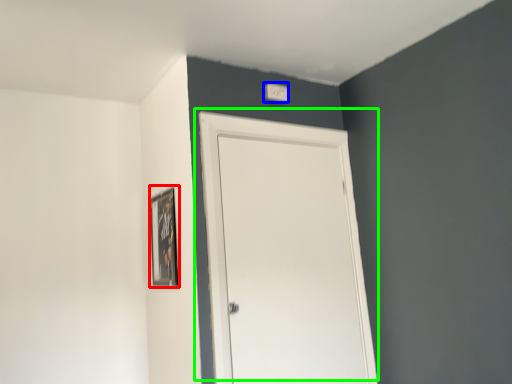
Question: Based on their relative distances, which object is nearer to picture frame (highlighted by a red box)? Choose from light switch (highlighted by a blue box) and door (highlighted by a green box).

Choices:
 (A) light switch
 (B) door

Answer: (B)